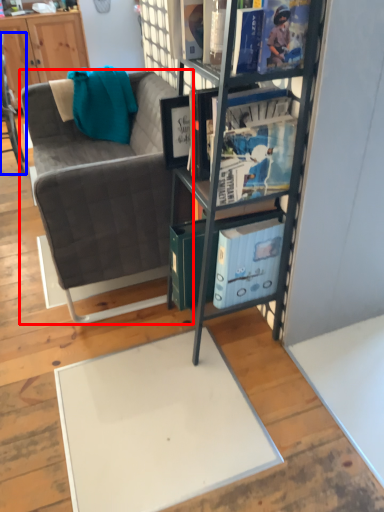
Question: Among these objects, which one is farthest to the camera, studio couch (highlighted by a red box) or chair (highlighted by a blue box)?

Choices:
 (A) studio couch
 (B) chair

Answer: (B)